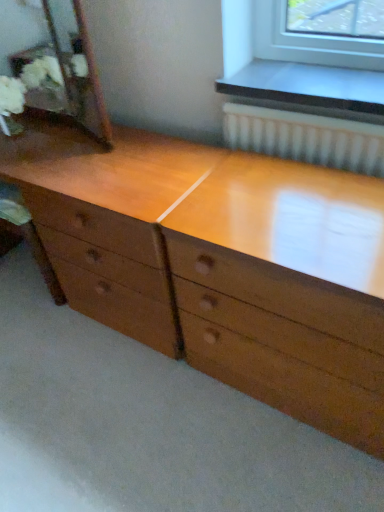
Question: In the image, is light brown wood chest of drawers at center on the left side or the right side of wooden mirror at left?

Choices:
 (A) right
 (B) left

Answer: (A)

Question: In the image, is light brown wood chest of drawers at center positioned in front of or behind wooden mirror at left?

Choices:
 (A) behind
 (B) front

Answer: (B)

Question: From a real-world perspective, is light brown wood chest of drawers at center positioned above or below wooden mirror at left?

Choices:
 (A) above
 (B) below

Answer: (B)

Question: Considering their positions, is wooden mirror at left located in front of or behind light brown wood chest of drawers at center?

Choices:
 (A) behind
 (B) front

Answer: (A)

Question: Is wooden mirror at left wider or thinner than light brown wood chest of drawers at center?

Choices:
 (A) thin
 (B) wide

Answer: (A)

Question: Is wooden mirror at left situated inside light brown wood chest of drawers at center or outside?

Choices:
 (A) inside
 (B) outside

Answer: (B)

Question: Is point (79, 84) closer or farther from the camera than point (86, 158)?

Choices:
 (A) closer
 (B) farther

Answer: (B)